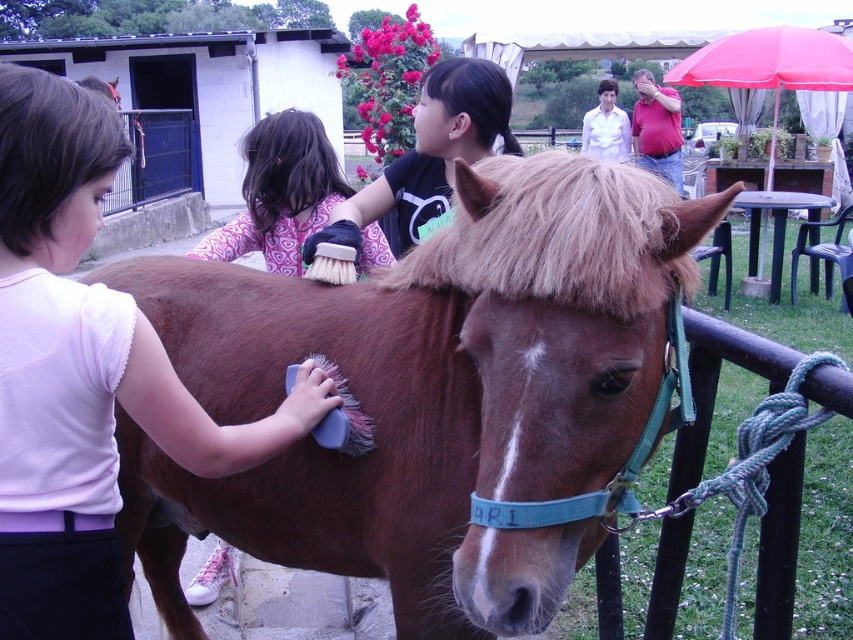
You are standing at the point labeled point (306, 186) and want to walk to the entrance of the petting zoo located at point (653, 202). Considering the layout of the scene described, will you have an unobstructed path to reach the entrance?

Since point (653, 202) is in front of point (306, 186), you will have an unobstructed path to reach the entrance.

You are a photographer trying to capture a group photo of the matte white shirt at left and the fuzzy brown mane at center. If you want to ensure both subjects are in focus, which one should you adjust your camera focus to prioritize based on their sizes?

The matte white shirt at left is narrower than the fuzzy brown mane at center, so you should prioritize focusing on the matte white shirt at left since it is smaller and requires more precise focus to capture details.

You are a visitor at the petting zoo and want to pet the brown matte horse at center. However, there is a patterned fabric brush at upper center above it. Can you reach the horse without moving the brush?

The brown matte horse at center is located below the patterned fabric brush at upper center, so you can reach the horse without moving the brush as it is positioned lower.